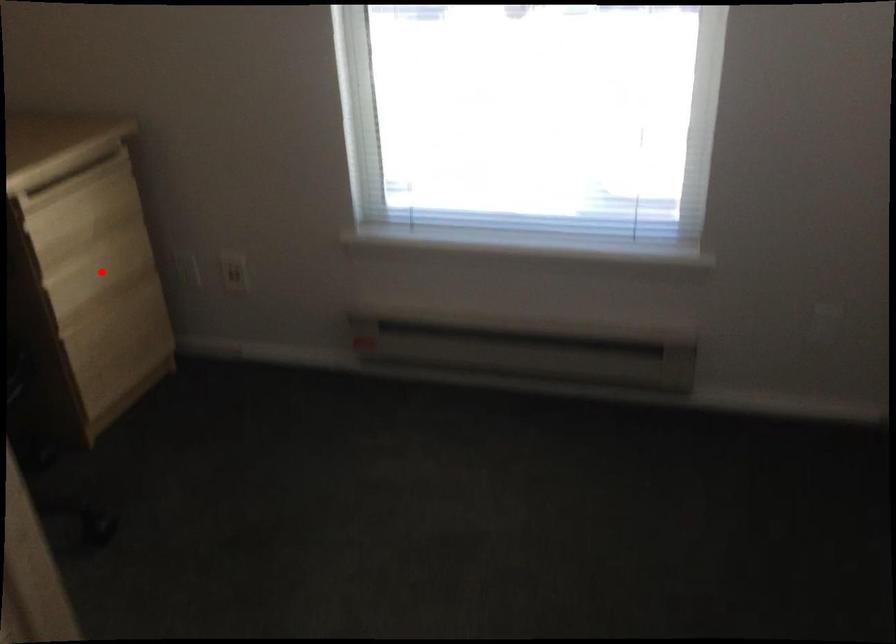
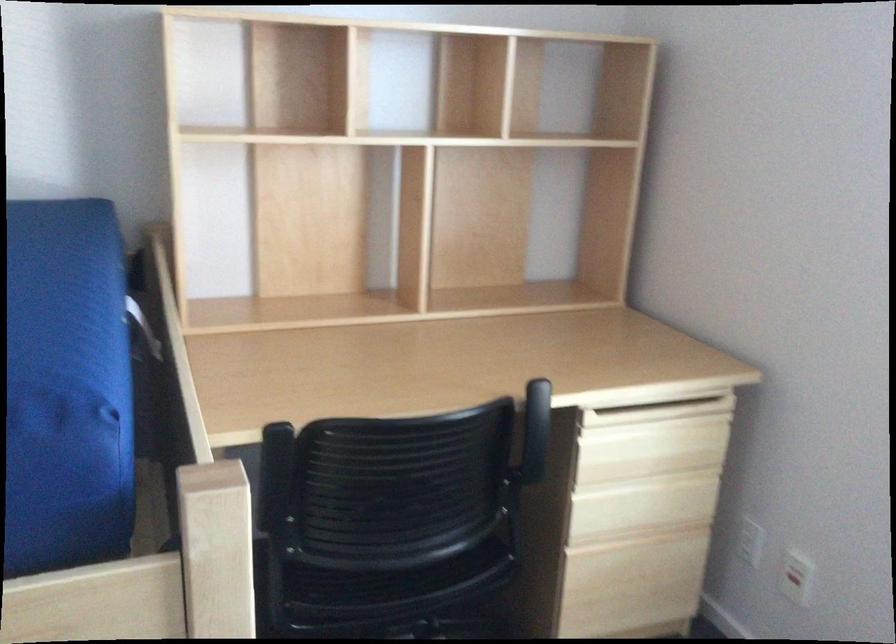
Find the pixel in the second image that matches the highlighted location in the first image.

(642, 506)